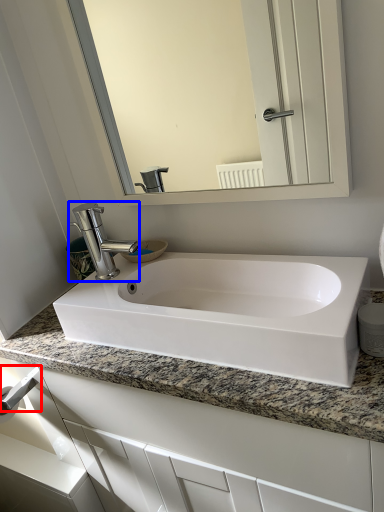
Question: Among these objects, which one is nearest to the camera, towel bar (highlighted by a red box) or tap (highlighted by a blue box)?

Choices:
 (A) towel bar
 (B) tap

Answer: (B)